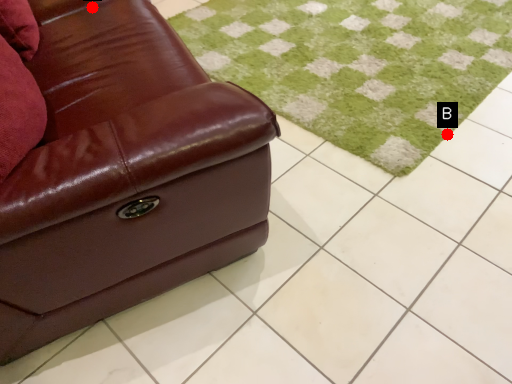
Question: Two points are circled on the image, labeled by A and B beside each circle. Which point is closer to the camera?

Choices:
 (A) A is closer
 (B) B is closer

Answer: (A)